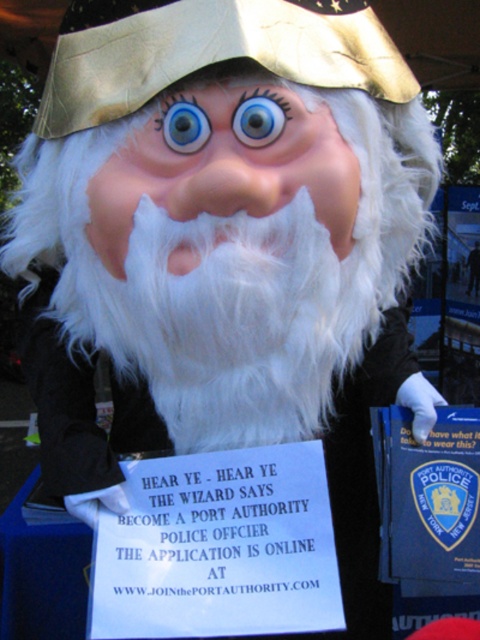
Question: Which object is the closest to the blue glossy eye at center?

Choices:
 (A) blue glossy eye at upper center
 (B) white paper sign at center

Answer: (A)

Question: Does white paper sign at center appear over blue glossy eye at center?

Choices:
 (A) no
 (B) yes

Answer: (A)

Question: Among these objects, which one is nearest to the camera?

Choices:
 (A) white paper sign at center
 (B) blue glossy eye at center

Answer: (B)

Question: Can you confirm if white paper sign at center is positioned below blue glossy eye at center?

Choices:
 (A) yes
 (B) no

Answer: (A)

Question: Is white paper sign at center bigger than blue glossy eye at upper center?

Choices:
 (A) yes
 (B) no

Answer: (A)

Question: Which of the following is the farthest from the observer?

Choices:
 (A) blue glossy eye at upper center
 (B) blue glossy eye at center

Answer: (A)